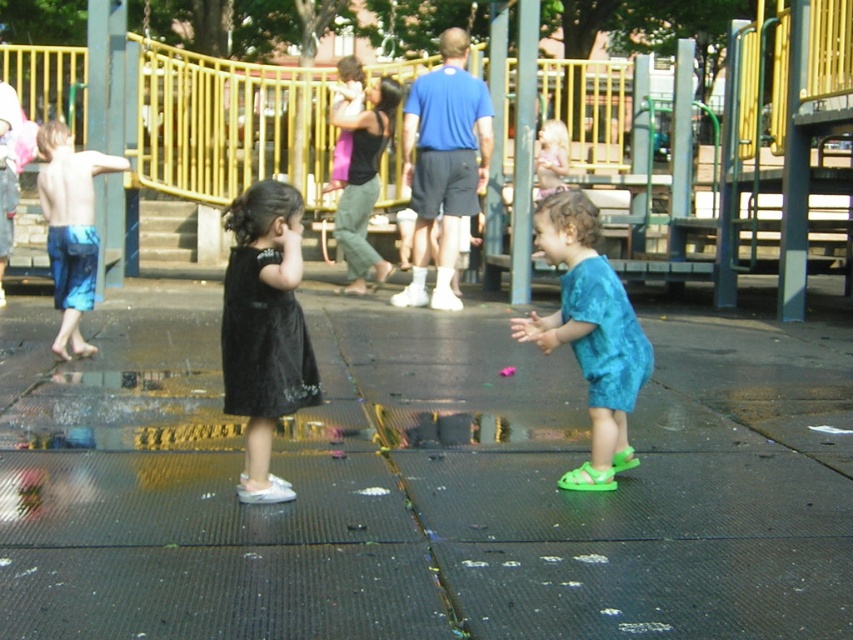
Question: Is black satin dress at center thinner than blue tie-dye shorts at left?

Choices:
 (A) yes
 (B) no

Answer: (A)

Question: Which of the following is the closest to the observer?

Choices:
 (A) blue tie-dye shorts at left
 (B) light blue fabric dress at center
 (C) teal fabric shirt at center
 (D) black rubber pavement at center

Answer: (D)

Question: Considering the real-world distances, which object is closest to the teal fabric shirt at center?

Choices:
 (A) light blue fabric dress at center
 (B) black rubber pavement at center

Answer: (B)

Question: Observing the image, what is the correct spatial positioning of teal fabric shirt at center in reference to light blue fabric dress at center?

Choices:
 (A) below
 (B) above

Answer: (A)

Question: Which of these objects is positioned farthest from the blue tie-dye shorts at left?

Choices:
 (A) teal fabric shirt at center
 (B) black rubber pavement at center
 (C) black satin dress at center
 (D) light blue fabric dress at center

Answer: (D)

Question: Does black satin dress at center have a lesser width compared to blue tie-dye shorts at left?

Choices:
 (A) no
 (B) yes

Answer: (B)